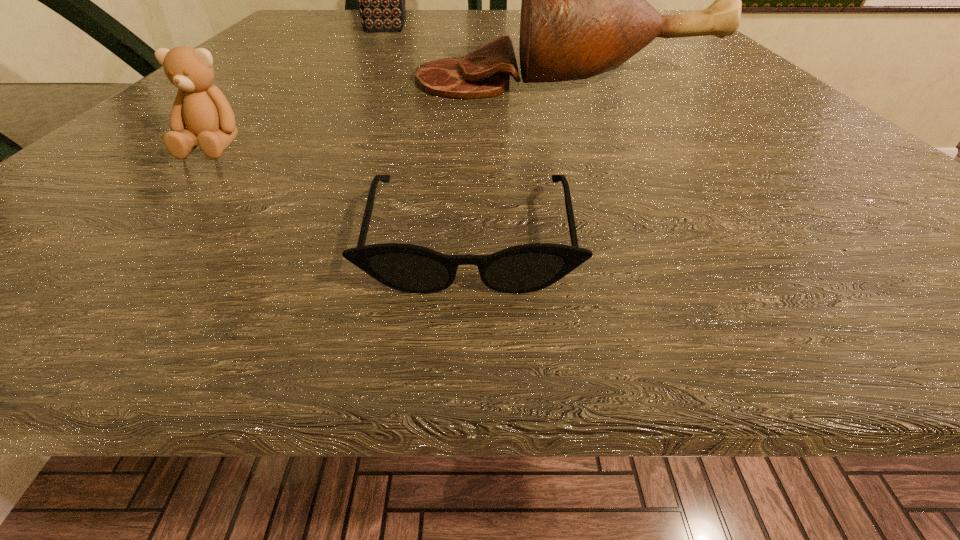
Find the location of a particular element. free spot located at the sliced end of the third nearest object is located at coordinates (272, 79).

At what (x,y) coordinates should I click in order to perform the action: click on vacant space located 0.060m at the sliced end of the third nearest object. Please return your answer as a coordinate pair (x, y). The height and width of the screenshot is (540, 960). Looking at the image, I should click on (374, 79).

The width and height of the screenshot is (960, 540). Find the location of `blank area located 0.170m on the face of the second nearest object`. blank area located 0.170m on the face of the second nearest object is located at coordinates (90, 267).

Locate an element on the screen. This screenshot has height=540, width=960. object that is at the far edge is located at coordinates (381, 0).

Identify the location of object located in the near edge section of the desktop. The image size is (960, 540). (525, 268).

The image size is (960, 540). In order to click on clutch bag present at the left edge in this screenshot , I will do `click(381, 0)`.

Where is `teddy bear at the left edge`? teddy bear at the left edge is located at coordinates (203, 109).

Find the location of `object that is at the right edge`. object that is at the right edge is located at coordinates (584, 11).

Find the location of a particular element. The image size is (960, 540). object at the far left corner is located at coordinates (381, 0).

This screenshot has width=960, height=540. I want to click on free location at the far edge, so click(473, 11).